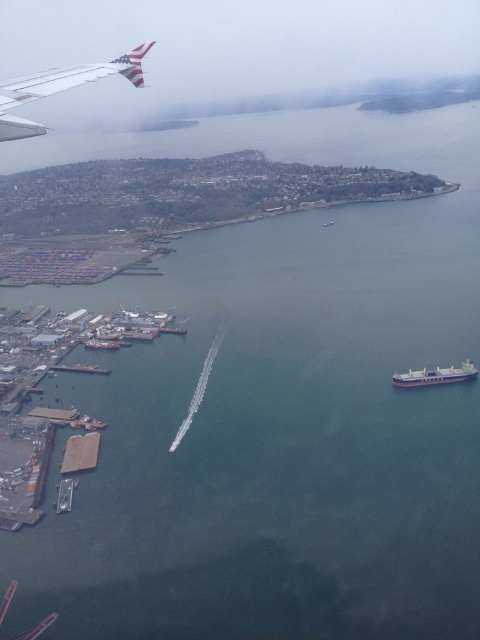
You are a pilot observing the scene from the airplane window. You notice the white matte cargo ship at lower right and the metallic gray boat at lower left. Which vessel has a greater height from the water surface?

The white matte cargo ship at lower right is taller than the metallic gray boat at lower left, so it has a greater height from the water surface.